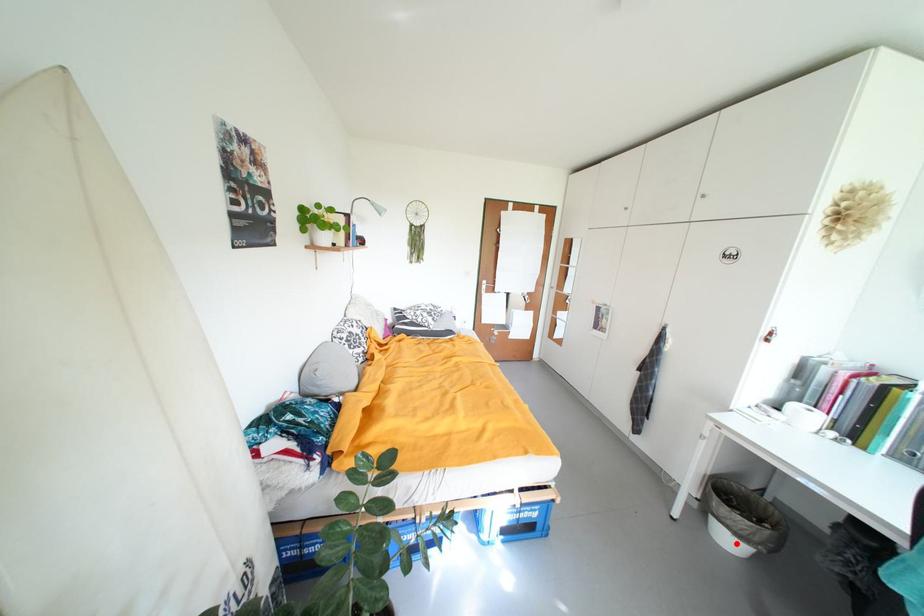
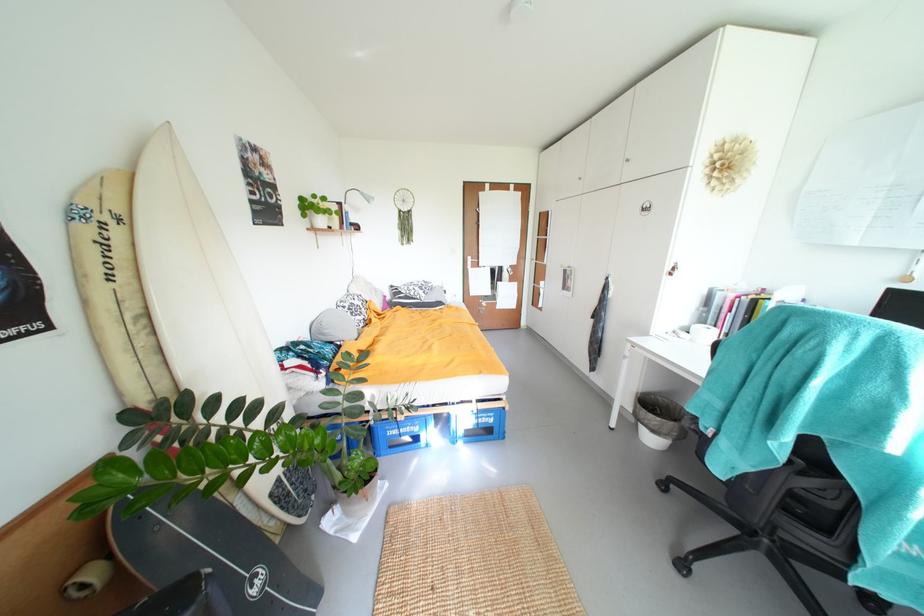
Question: I am providing you with two images of the same scene from different viewpoints. In image1, a red point is highlighted. Considering the same 3D point in image2, which of the following is correct?

Choices:
 (A) It is closer
 (B) It is farther

Answer: (A)